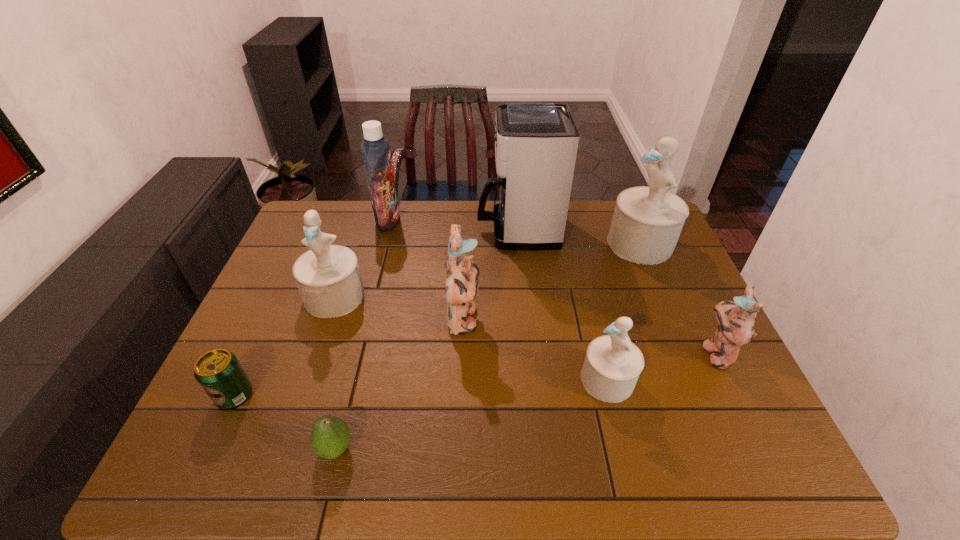
At what (x,y) coordinates should I click in order to perform the action: click on coffee maker. Please return your answer as a coordinate pair (x, y). Image resolution: width=960 pixels, height=540 pixels. Looking at the image, I should click on (536, 144).

At what (x,y) coordinates should I click in order to perform the action: click on the farthest figurine. Please return your answer as a coordinate pair (x, y). The height and width of the screenshot is (540, 960). Looking at the image, I should click on (647, 221).

Find the location of a particular element. This screenshot has height=540, width=960. the rightmost white figurine is located at coordinates (647, 221).

I want to click on shampoo, so click(375, 149).

Identify the location of the second farthest white figurine. (328, 277).

Identify the location of the leftmost figurine. The image size is (960, 540). (328, 277).

Where is `the left pink figurine`? The height and width of the screenshot is (540, 960). the left pink figurine is located at coordinates (461, 274).

Identify the location of the fourth figurine from right to left. The width and height of the screenshot is (960, 540). (461, 274).

Where is `the nearest white figurine`? the nearest white figurine is located at coordinates (612, 365).

Locate an element on the screen. The width and height of the screenshot is (960, 540). the second white figurine from right to left is located at coordinates (612, 365).